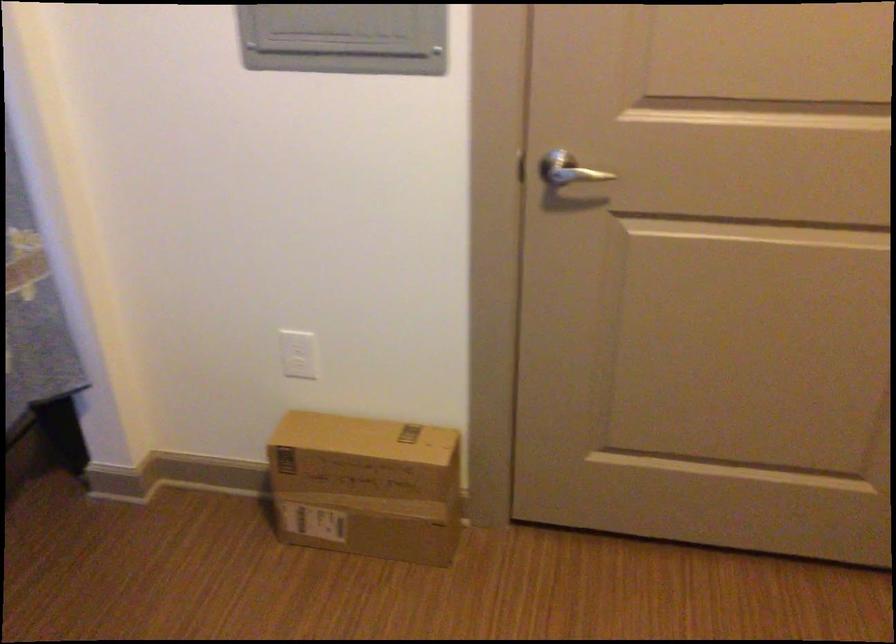
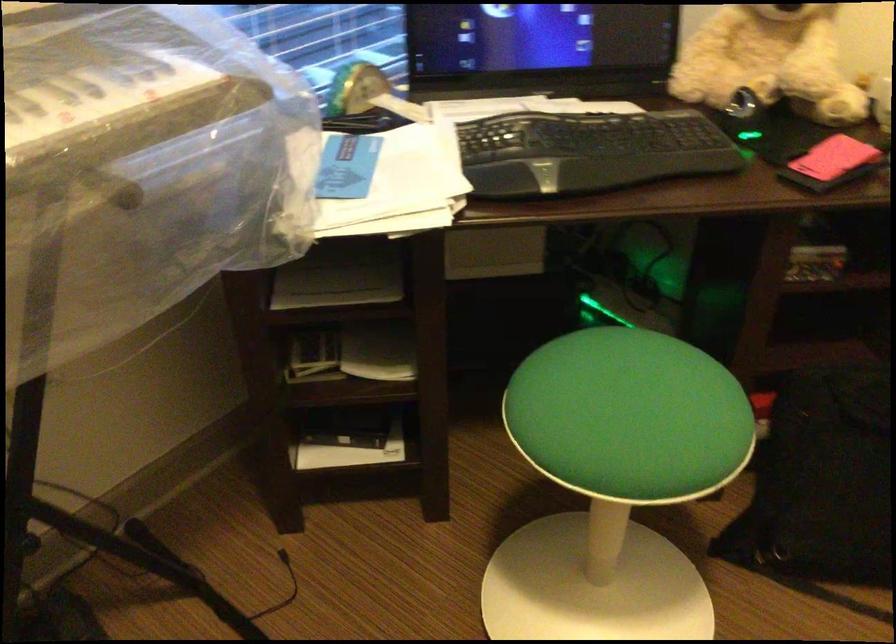
The first image is from the beginning of the video and the second image is from the end. How did the camera likely rotate when shooting the video?

The camera's rotation is toward left-down.